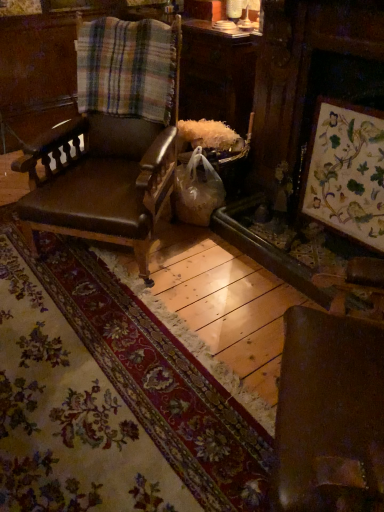
Identify the location of vacant space in front of brown leather chair at center. Image resolution: width=384 pixels, height=512 pixels. pos(120,321).